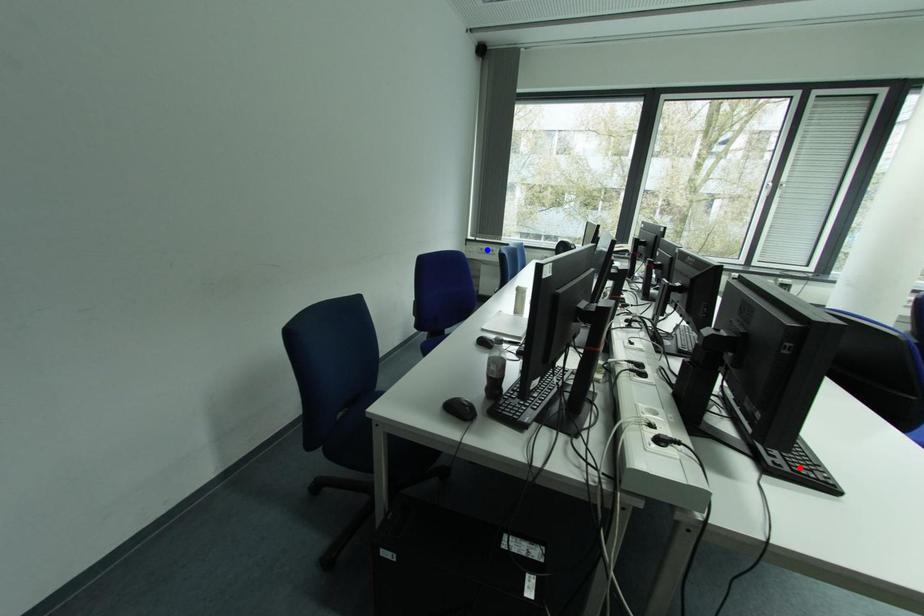
Question: In the image, two points are highlighted. Which point is nearer to the camera? Reply with the corresponding letter.

Choices:
 (A) blue point
 (B) red point

Answer: (B)